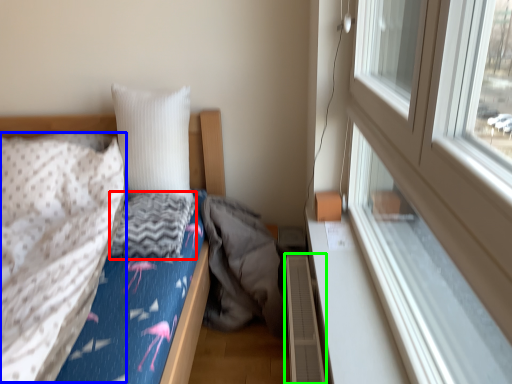
Question: Estimate the real-world distances between objects in this image. Which object is closer to material (highlighted by a red box), blanket (highlighted by a blue box) or radiator (highlighted by a green box)?

Choices:
 (A) blanket
 (B) radiator

Answer: (A)